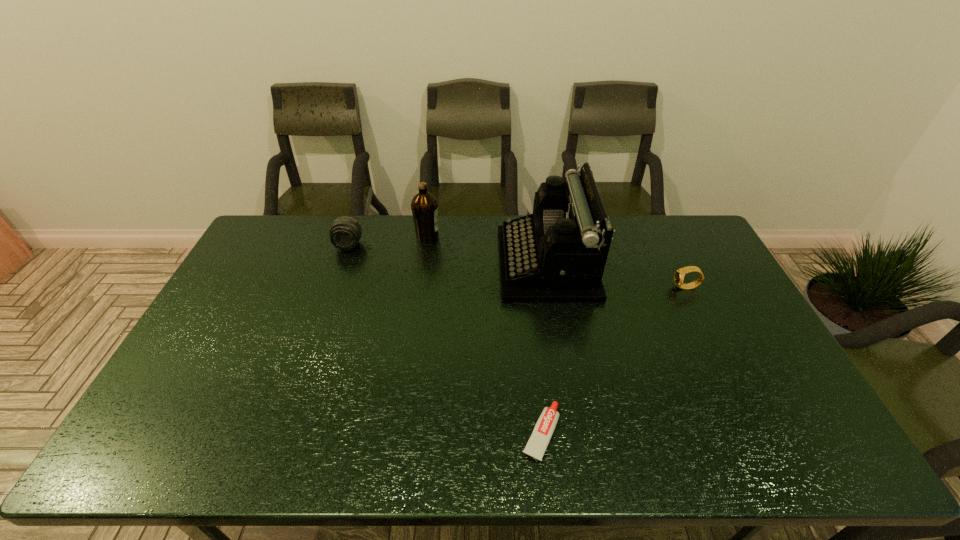
At what (x,y) coordinates should I click in order to perform the action: click on telephoto lens present at the far edge. Please return your answer as a coordinate pair (x, y). Looking at the image, I should click on (345, 233).

Locate an element on the screen. This screenshot has height=540, width=960. object that is at the near edge is located at coordinates (536, 446).

Where is `object that is at the right edge`? object that is at the right edge is located at coordinates (679, 275).

This screenshot has width=960, height=540. In the image, there is a desktop. Identify the location of blank space at the near edge. (510, 456).

The height and width of the screenshot is (540, 960). In the image, there is a desktop. Identify the location of vacant region at the left edge. (227, 300).

Locate an element on the screen. This screenshot has height=540, width=960. free space at the right edge of the desktop is located at coordinates (804, 424).

Locate an element on the screen. vacant region at the far left corner of the desktop is located at coordinates (298, 220).

Locate an element on the screen. The width and height of the screenshot is (960, 540). blank region between the nearest object and the leftmost object is located at coordinates (444, 339).

Find the location of `vacant space in between the olive oil and the typewriter`. vacant space in between the olive oil and the typewriter is located at coordinates (487, 249).

I want to click on free space between the second tallest object and the typewriter, so click(x=487, y=249).